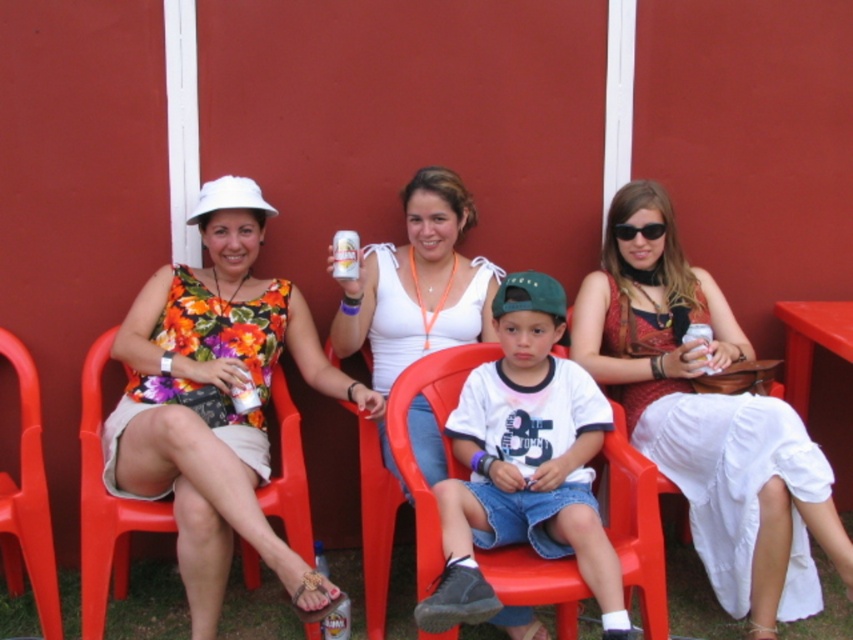
In the scene shown: Does matte red dress at center have a smaller size compared to black plastic sunglasses at upper center?

Incorrect, matte red dress at center is not smaller in size than black plastic sunglasses at upper center.

Between point (724, 321) and point (656, 228), which one is positioned in front?

Positioned in front is point (656, 228).

This screenshot has width=853, height=640. Find the location of `matte red dress at center`. matte red dress at center is located at coordinates (708, 420).

Which of these two, floral fabric top at left or green fabric baseball cap at center, stands taller?

With more height is floral fabric top at left.

Does point (277, 554) come farther from viewer compared to point (503, 282)?

No, (277, 554) is in front of (503, 282).

Does point (160, 301) come closer to viewer compared to point (531, 273)?

That is False.

Where is `floral fabric top at left`? This screenshot has height=640, width=853. floral fabric top at left is located at coordinates (216, 410).

Who is positioned more to the left, white fabric baseball hat at left or metallic silver can at center?

white fabric baseball hat at left is more to the left.

Is white fabric baseball hat at left smaller than metallic silver can at center?

Actually, white fabric baseball hat at left might be larger than metallic silver can at center.

Who is more distant from viewer, (202, 186) or (337, 276)?

The point (202, 186) is behind.

Where is `white fabric baseball hat at left`? Image resolution: width=853 pixels, height=640 pixels. white fabric baseball hat at left is located at coordinates (229, 196).